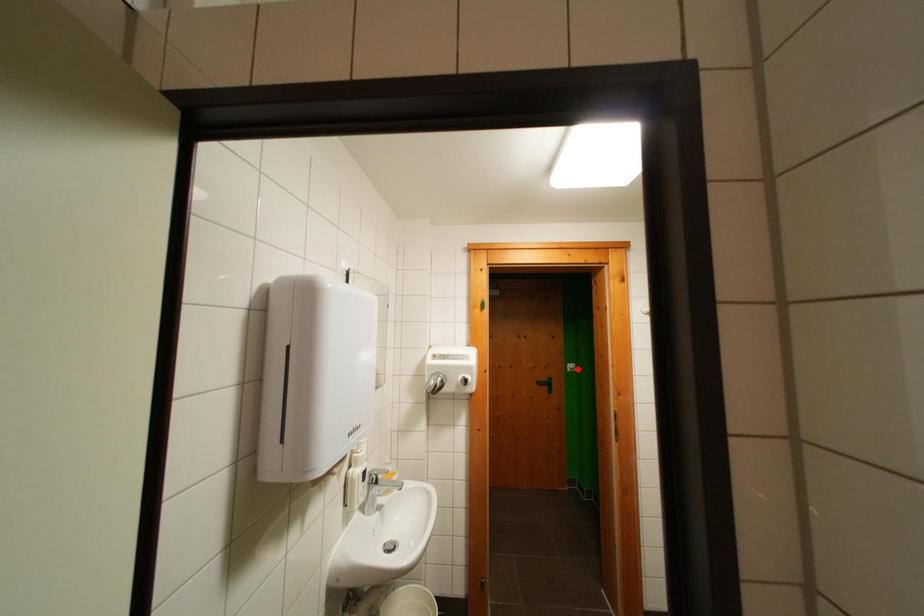
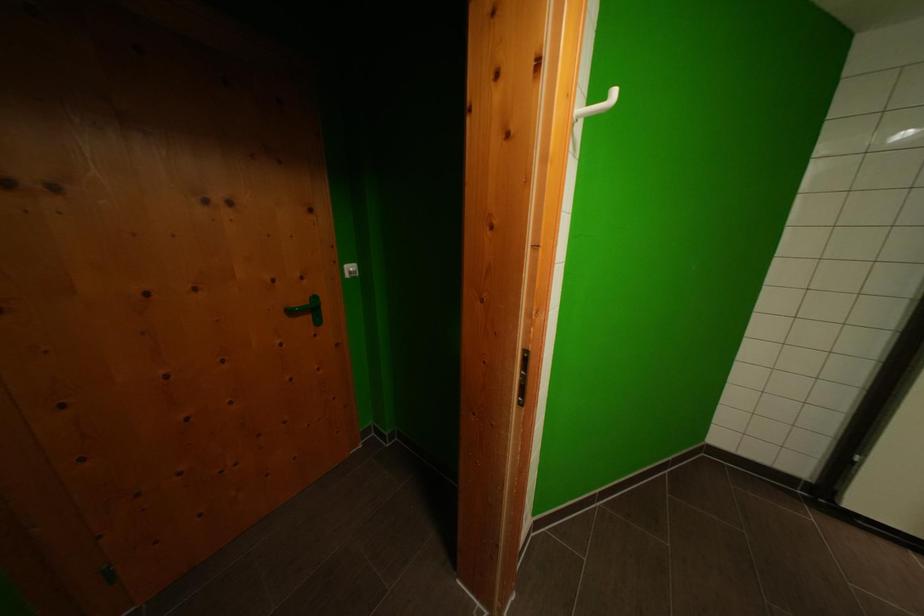
Question: I am providing you with two images of the same scene from different viewpoints. A red point is shown in image1. For the corresponding object point in image2, is it positioned nearer or farther from the camera?

Choices:
 (A) Nearer
 (B) Farther

Answer: (A)